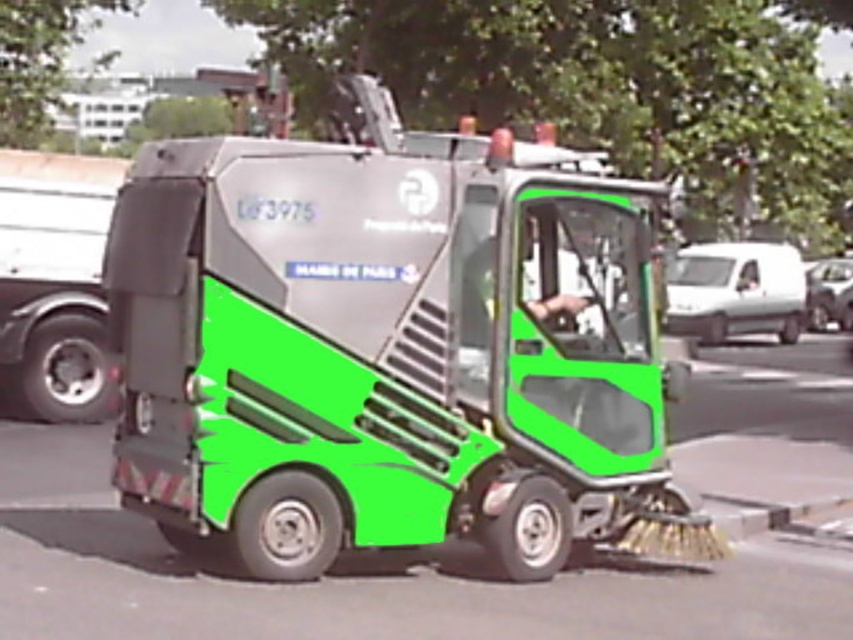
Question: Can you confirm if metallic silver truck at left is wider than smooth skin hand at center?

Choices:
 (A) no
 (B) yes

Answer: (B)

Question: Does metallic silver truck at left appear on the right side of smooth skin hand at center?

Choices:
 (A) yes
 (B) no

Answer: (B)

Question: Is metallic silver truck at left above smooth skin hand at center?

Choices:
 (A) no
 (B) yes

Answer: (B)

Question: Among these objects, which one is nearest to the camera?

Choices:
 (A) metallic gray garbage truck at center
 (B) metallic silver truck at left

Answer: (A)

Question: Which object appears farthest from the camera in this image?

Choices:
 (A) smooth skin hand at center
 (B) metallic silver truck at left

Answer: (B)

Question: Which point appears farthest from the camera in this image?

Choices:
 (A) (42, 275)
 (B) (405, 396)
 (C) (572, 282)

Answer: (A)